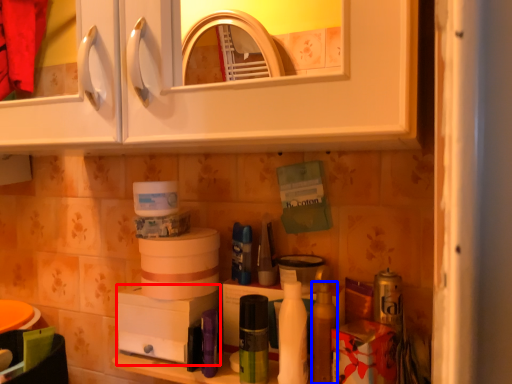
Question: Among these objects, which one is nearest to the camera, appliance (highlighted by a red box) or toiletry (highlighted by a blue box)?

Choices:
 (A) appliance
 (B) toiletry

Answer: (B)